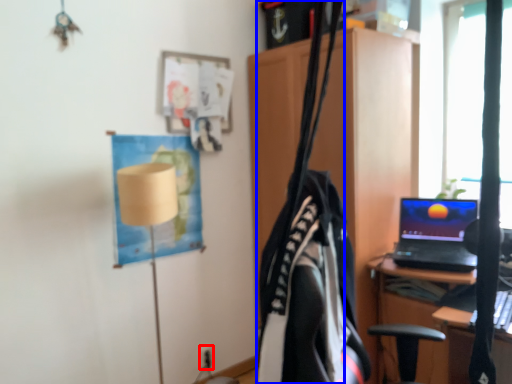
Question: Among these objects, which one is nearest to the camera, electric outlet (highlighted by a red box) or clothesline (highlighted by a blue box)?

Choices:
 (A) electric outlet
 (B) clothesline

Answer: (B)